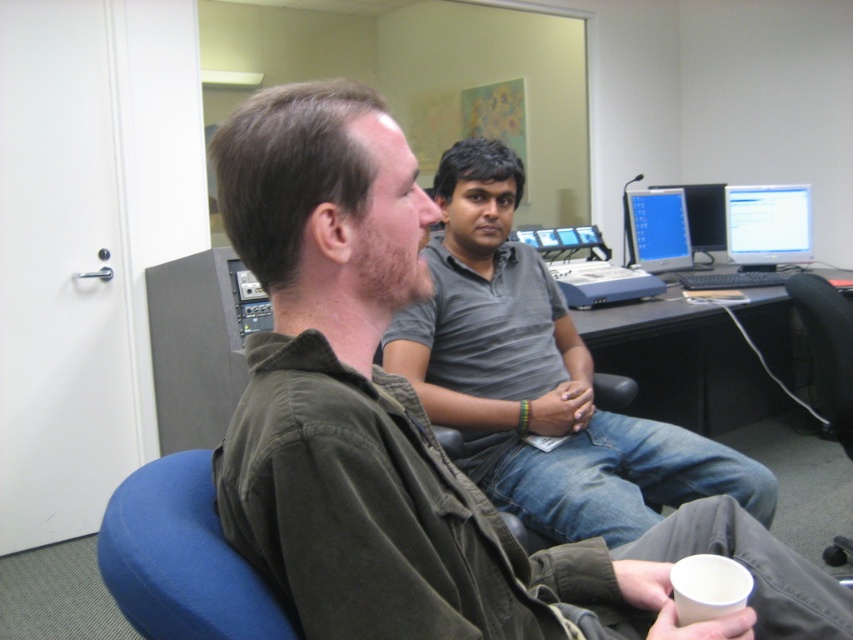
Based on the photo, is matte gray monitor at upper right below matte blue monitor at upper right?

No, matte gray monitor at upper right is not below matte blue monitor at upper right.

Does matte gray monitor at upper right appear on the right side of matte blue monitor at upper right?

Yes, matte gray monitor at upper right is to the right of matte blue monitor at upper right.

Describe the element at coordinates (767, 225) in the screenshot. The image size is (853, 640). I see `matte gray monitor at upper right` at that location.

At what (x,y) coordinates should I click in order to perform the action: click on matte gray monitor at upper right. Please return your answer as a coordinate pair (x, y). The image size is (853, 640). Looking at the image, I should click on (767, 225).

Does gray cotton shirt at center lie in front of black plastic chair at lower right?

Yes, gray cotton shirt at center is closer to the viewer.

Does gray cotton shirt at center have a greater width compared to black plastic chair at lower right?

Yes.

Is point (544, 276) positioned before point (846, 346)?

Yes, it is.

Locate an element on the screen. The height and width of the screenshot is (640, 853). gray cotton shirt at center is located at coordinates (538, 380).

Locate an element on the screen. blue fabric swivel chair at left is located at coordinates (181, 557).

Does blue fabric swivel chair at left appear over matte black monitor at center?

No.

Which is behind, point (154, 595) or point (718, 211)?

Point (718, 211)

I want to click on blue fabric swivel chair at left, so click(x=181, y=557).